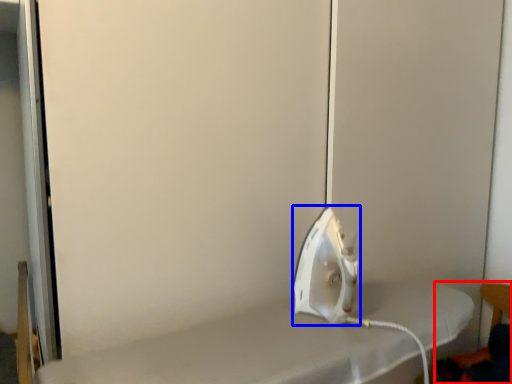
Question: Which object appears closest to the camera in this image, chair (highlighted by a red box) or appliance (highlighted by a blue box)?

Choices:
 (A) chair
 (B) appliance

Answer: (B)